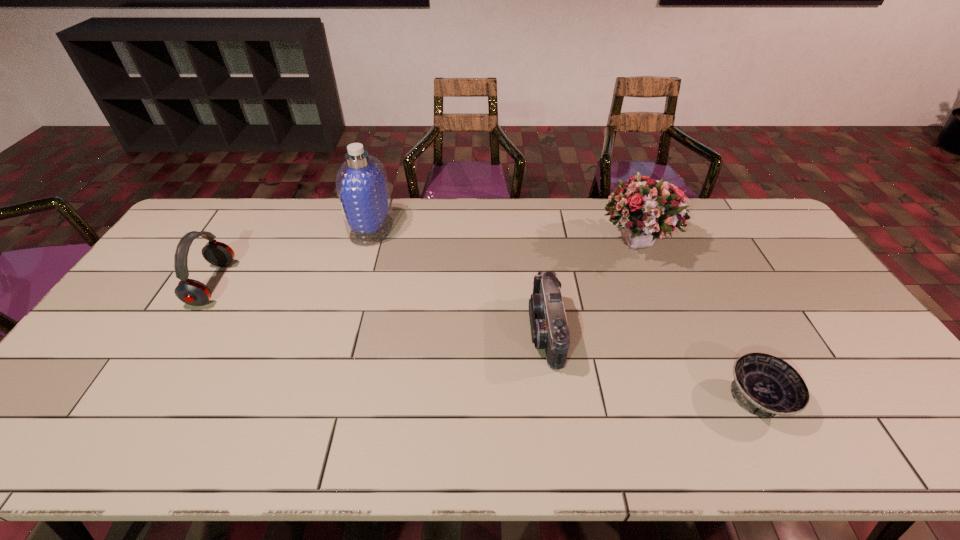
Find the location of a particular element. The image size is (960, 540). empty space between the third shortest object and the cleansing agent is located at coordinates (292, 256).

This screenshot has width=960, height=540. What are the coordinates of `free area in between the third object from left to right and the third shortest object` in the screenshot? It's located at (379, 307).

I want to click on vacant space that is in between the bowl and the third tallest object, so click(x=485, y=341).

Identify which object is the fourth closest to the camcorder. Please provide its 2D coordinates. Your answer should be formatted as a tuple, i.e. [(x, y)], where the tuple contains the x and y coordinates of a point satisfying the conditions above.

[(192, 292)]

Locate an element on the screen. This screenshot has width=960, height=540. object that is the fourth closest to the cleansing agent is located at coordinates (764, 385).

This screenshot has height=540, width=960. In order to click on free space in the image that satisfies the following two spatial constraints: 1. on the front-facing side of the shortest object; 2. on the left side of the third object from right to left in this screenshot , I will do `click(556, 399)`.

The height and width of the screenshot is (540, 960). Identify the location of free space that satisfies the following two spatial constraints: 1. on the front side of the second tallest object; 2. on the front-facing side of the fourth tallest object. (673, 331).

You are a GUI agent. You are given a task and a screenshot of the screen. Output one action in this format:
    pyautogui.click(x=<x>, y=<y>)
    Task: Click on the vacant region that satisfies the following two spatial constraints: 1. on the front side of the fourth shortest object; 2. on the left side of the bowl
    The image size is (960, 540).
    Given the screenshot: What is the action you would take?
    pyautogui.click(x=700, y=399)

At what (x,y) coordinates should I click in order to perform the action: click on free space in the image that satisfies the following two spatial constraints: 1. on the front-facing side of the third object from right to left; 2. on the left side of the bowl. Please return your answer as a coordinate pair (x, y). The height and width of the screenshot is (540, 960). Looking at the image, I should click on (556, 399).

Locate an element on the screen. free location that satisfies the following two spatial constraints: 1. on the front-facing side of the bowl; 2. on the left side of the third object from left to right is located at coordinates (556, 399).